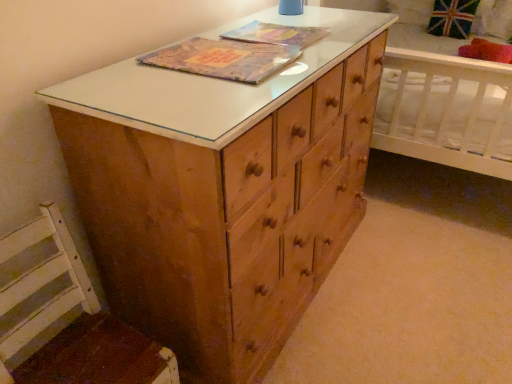
The height and width of the screenshot is (384, 512). I want to click on red plush pillow at upper right, so click(x=486, y=51).

Which object is wider, matte plastic book at center, the 2th book cover when ordered from front to back, or wooden swivel chair at lower left?

Wider between the two is wooden swivel chair at lower left.

Where is `the 2nd book cover behind the wooden swivel chair at lower left, starting your count from the anchor`? The image size is (512, 384). the 2nd book cover behind the wooden swivel chair at lower left, starting your count from the anchor is located at coordinates (276, 34).

Considering the relative positions of matte plastic book at center, the 2th book cover when ordered from front to back, and wooden swivel chair at lower left in the image provided, is matte plastic book at center, the 2th book cover when ordered from front to back, to the left of wooden swivel chair at lower left from the viewer's perspective?

No.

Considering their positions, is matte plastic book at center, which appears as the 1th book cover when viewed from the back, located in front of or behind wooden swivel chair at lower left?

In the image, matte plastic book at center, which appears as the 1th book cover when viewed from the back, appears behind wooden swivel chair at lower left.

The image size is (512, 384). In order to click on pillow that appears above the wooden swivel chair at lower left (from the image's perspective) in this screenshot , I will do `click(486, 51)`.

Looking at this image, considering the positions of objects red plush pillow at upper right and wooden swivel chair at lower left in the image provided, who is more to the right, red plush pillow at upper right or wooden swivel chair at lower left?

red plush pillow at upper right.

Can you confirm if red plush pillow at upper right is bigger than wooden swivel chair at lower left?

Actually, red plush pillow at upper right might be smaller than wooden swivel chair at lower left.

From a real-world perspective, is red plush pillow at upper right on top of wooden swivel chair at lower left?

Yes, from a real-world perspective, red plush pillow at upper right is on top of wooden swivel chair at lower left.

Considering the relative sizes of wooden swivel chair at lower left and red plush pillow at upper right in the image provided, is wooden swivel chair at lower left thinner than red plush pillow at upper right?

Yes.

Is wooden swivel chair at lower left not near red plush pillow at upper right?

That's right, there is a large distance between wooden swivel chair at lower left and red plush pillow at upper right.

The height and width of the screenshot is (384, 512). Find the location of `pillow above the wooden swivel chair at lower left (from a real-world perspective)`. pillow above the wooden swivel chair at lower left (from a real-world perspective) is located at coordinates (486, 51).

From a real-world perspective, is matte plastic book at center, which appears as the 1th book cover when viewed from the back, located beneath textured paper book at center, which appears as the first book cover when viewed from the front?

Indeed, from a real-world perspective, matte plastic book at center, which appears as the 1th book cover when viewed from the back, is positioned beneath textured paper book at center, which appears as the first book cover when viewed from the front.

Is matte plastic book at center, which appears as the 1th book cover when viewed from the back, facing away from textured paper book at center, which appears as the first book cover when viewed from the front?

That's not correct — matte plastic book at center, which appears as the 1th book cover when viewed from the back, is not looking away from textured paper book at center, which appears as the first book cover when viewed from the front.

Is matte plastic book at center, the 2th book cover when ordered from front to back, completely or partially outside of textured paper book at center, which appears as the first book cover when viewed from the front?

matte plastic book at center, the 2th book cover when ordered from front to back, is positioned outside textured paper book at center, which appears as the first book cover when viewed from the front.

Is matte plastic book at center, which appears as the 1th book cover when viewed from the back, thinner than textured paper book at center, the second book cover in the back-to-front sequence?

Indeed, matte plastic book at center, which appears as the 1th book cover when viewed from the back, has a lesser width compared to textured paper book at center, the second book cover in the back-to-front sequence.

Is textured paper book at center, the second book cover in the back-to-front sequence, looking in the opposite direction of red plush pillow at upper right?

textured paper book at center, the second book cover in the back-to-front sequence, does not have its back to red plush pillow at upper right.

This screenshot has height=384, width=512. Find the location of `pillow located underneath the textured paper book at center, the second book cover in the back-to-front sequence (from a real-world perspective)`. pillow located underneath the textured paper book at center, the second book cover in the back-to-front sequence (from a real-world perspective) is located at coordinates (486, 51).

Is textured paper book at center, which appears as the first book cover when viewed from the front, positioned beyond the bounds of red plush pillow at upper right?

Yes, textured paper book at center, which appears as the first book cover when viewed from the front, is not within red plush pillow at upper right.

Does textured paper book at center, the second book cover in the back-to-front sequence, have a lesser width compared to red plush pillow at upper right?

Yes, textured paper book at center, the second book cover in the back-to-front sequence, is thinner than red plush pillow at upper right.

The height and width of the screenshot is (384, 512). In order to click on pillow lying above the matte plastic book at center, the 2th book cover when ordered from front to back (from the image's perspective) in this screenshot , I will do `click(486, 51)`.

Are matte plastic book at center, the 2th book cover when ordered from front to back, and red plush pillow at upper right beside each other?

They are not placed beside each other.

How different are the orientations of matte plastic book at center, the 2th book cover when ordered from front to back, and red plush pillow at upper right in degrees?

matte plastic book at center, the 2th book cover when ordered from front to back, and red plush pillow at upper right are facing 90.2 degrees away from each other.

Between matte plastic book at center, the 2th book cover when ordered from front to back, and red plush pillow at upper right, which one has larger size?

With larger size is red plush pillow at upper right.

Based on the photo, between wooden swivel chair at lower left and textured paper book at center, the second book cover in the back-to-front sequence, which one has larger width?

wooden swivel chair at lower left is wider.

Based on their positions, is wooden swivel chair at lower left located to the left or right of textured paper book at center, which appears as the first book cover when viewed from the front?

wooden swivel chair at lower left is to the left of textured paper book at center, which appears as the first book cover when viewed from the front.

Is wooden swivel chair at lower left shorter than textured paper book at center, which appears as the first book cover when viewed from the front?

Incorrect, the height of wooden swivel chair at lower left does not fall short of that of textured paper book at center, which appears as the first book cover when viewed from the front.

Who is bigger, wooden swivel chair at lower left or textured paper book at center, which appears as the first book cover when viewed from the front?

wooden swivel chair at lower left is bigger.

This screenshot has width=512, height=384. In order to click on swivel chair in front of the matte plastic book at center, the 2th book cover when ordered from front to back in this screenshot , I will do `click(65, 317)`.

Find the location of a particular element. pillow behind the wooden swivel chair at lower left is located at coordinates (486, 51).

When comparing their distances from wooden swivel chair at lower left, does matte plastic book at center, which appears as the 1th book cover when viewed from the back, or textured paper book at center, the second book cover in the back-to-front sequence, seem further?

matte plastic book at center, which appears as the 1th book cover when viewed from the back, is further to wooden swivel chair at lower left.

Considering their positions, is red plush pillow at upper right positioned closer to wooden swivel chair at lower left than matte plastic book at center, which appears as the 1th book cover when viewed from the back?

Among the two, matte plastic book at center, which appears as the 1th book cover when viewed from the back, is located nearer to wooden swivel chair at lower left.

Which object lies nearer to the anchor point wooden swivel chair at lower left, textured paper book at center, which appears as the first book cover when viewed from the front, or red plush pillow at upper right?

textured paper book at center, which appears as the first book cover when viewed from the front.

When comparing their distances from red plush pillow at upper right, does matte plastic book at center, which appears as the 1th book cover when viewed from the back, or wooden swivel chair at lower left seem closer?

matte plastic book at center, which appears as the 1th book cover when viewed from the back, is positioned closer to the anchor red plush pillow at upper right.

From the image, which object appears to be farther from matte plastic book at center, which appears as the 1th book cover when viewed from the back, red plush pillow at upper right or wooden swivel chair at lower left?

red plush pillow at upper right.

From the image, which object appears to be farther from matte plastic book at center, which appears as the 1th book cover when viewed from the back, textured paper book at center, which appears as the first book cover when viewed from the front, or wooden swivel chair at lower left?

wooden swivel chair at lower left is positioned further to the anchor matte plastic book at center, which appears as the 1th book cover when viewed from the back.

Consider the image. Based on their spatial positions, is matte plastic book at center, which appears as the 1th book cover when viewed from the back, or red plush pillow at upper right further from wooden swivel chair at lower left?

Based on the image, red plush pillow at upper right appears to be further to wooden swivel chair at lower left.

Considering their positions, is matte plastic book at center, the 2th book cover when ordered from front to back, positioned closer to red plush pillow at upper right than textured paper book at center, the second book cover in the back-to-front sequence?

The object closer to red plush pillow at upper right is matte plastic book at center, the 2th book cover when ordered from front to back.

Locate an element on the screen. book cover located between textured paper book at center, the second book cover in the back-to-front sequence, and red plush pillow at upper right in the left-right direction is located at coordinates (276, 34).

Identify the location of book cover between matte plastic book at center, which appears as the 1th book cover when viewed from the back, and wooden swivel chair at lower left in the up-down direction. This screenshot has height=384, width=512. (224, 59).